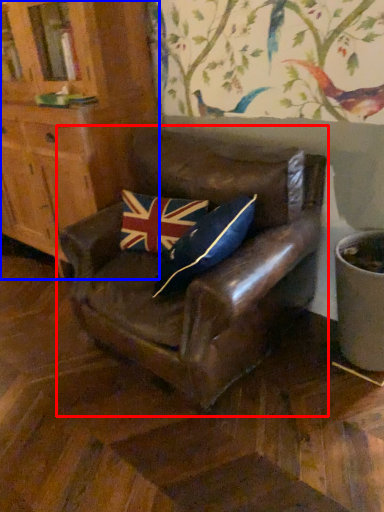
Question: Which point is closer to the camera, chair (highlighted by a red box) or cabinetry (highlighted by a blue box)?

Choices:
 (A) chair
 (B) cabinetry

Answer: (A)